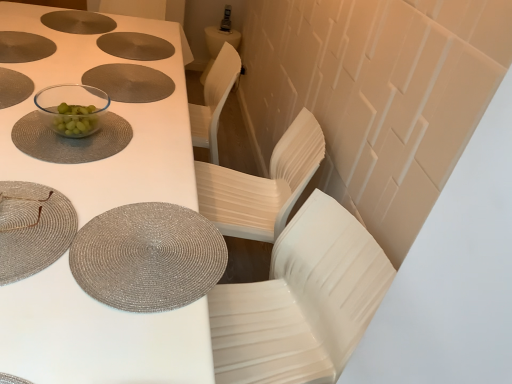
I want to click on free spot behind silver textured placemat at lower left, the 2th tableware positioned from the front, so click(145, 168).